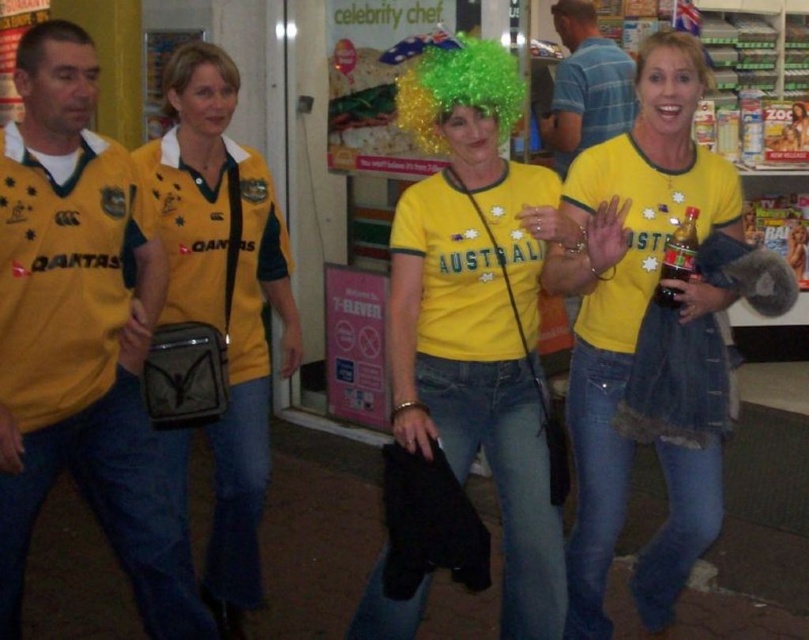
Question: Can you confirm if yellow jersey at left is thinner than brown matte hair at upper center?

Choices:
 (A) yes
 (B) no

Answer: (B)

Question: Which point appears closest to the camera in this image?

Choices:
 (A) (17, 202)
 (B) (689, 54)

Answer: (A)

Question: Which point is farther to the camera?

Choices:
 (A) (138, 458)
 (B) (494, 40)
 (C) (58, 33)
 (D) (231, 80)

Answer: (B)

Question: Which of the following is the closest to the observer?

Choices:
 (A) blue plaid shirt at upper center
 (B) yellow matte jersey at center
 (C) brown matte hair at upper center

Answer: (B)

Question: Observing the image, what is the correct spatial positioning of blonde hair at upper left in reference to brown matte hair at upper center?

Choices:
 (A) above
 (B) below

Answer: (B)

Question: Does brown curly hair at upper left have a larger size compared to brown matte hair at upper center?

Choices:
 (A) yes
 (B) no

Answer: (B)